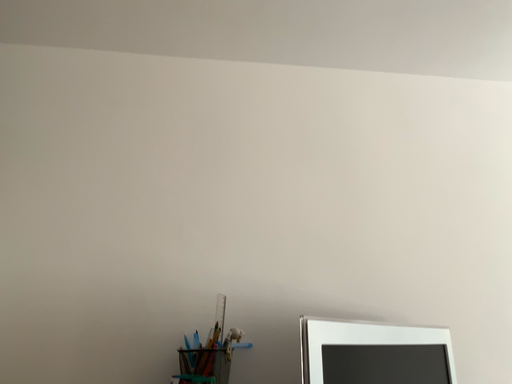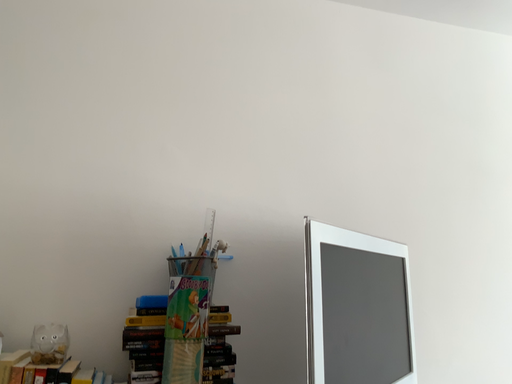
Question: How did the camera likely rotate when shooting the video?

Choices:
 (A) rotated right
 (B) rotated left

Answer: (A)